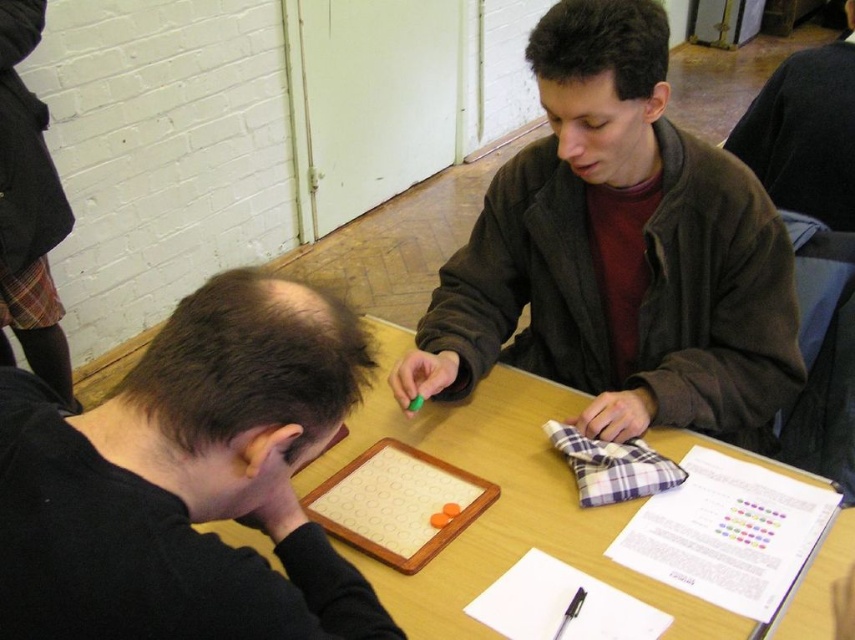
Can you confirm if black matte shirt at lower left is bigger than wooden table at center?

No.

Who is lower down, black matte shirt at lower left or wooden table at center?

wooden table at center

What do you see at coordinates (186, 481) in the screenshot? I see `black matte shirt at lower left` at bounding box center [186, 481].

Where is `black matte shirt at lower left`? This screenshot has width=855, height=640. black matte shirt at lower left is located at coordinates (186, 481).

Is point (789, 269) positioned after point (34, 461)?

Yes.

Is point (724, 374) positioned in front of point (322, 536)?

No.

Find the location of a particular element. This screenshot has height=640, width=855. dark brown jacket at center is located at coordinates (618, 253).

Is dark brown jacket at center to the left of wooden table at center from the viewer's perspective?

No, dark brown jacket at center is not to the left of wooden table at center.

Is dark brown jacket at center wider than wooden table at center?

No, dark brown jacket at center is not wider than wooden table at center.

At what (x,y) coordinates should I click in order to perform the action: click on dark brown jacket at center. Please return your answer as a coordinate pair (x, y). This screenshot has width=855, height=640. Looking at the image, I should click on (618, 253).

Locate an element on the screen. dark brown jacket at center is located at coordinates 618,253.